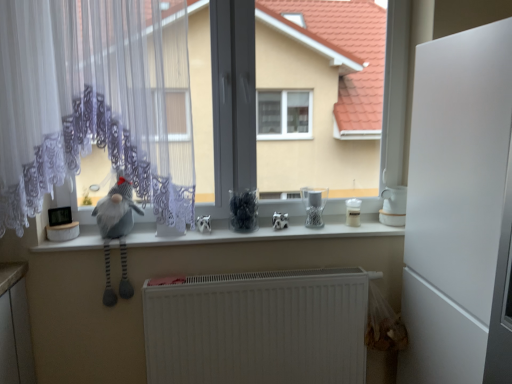
Locate an element on the screen. free space between clear glass jar at center, marked as the first appliance in a left-to-right arrangement, and white plastic container at center, which is the 2th appliance in left-to-right order is located at coordinates (337, 224).